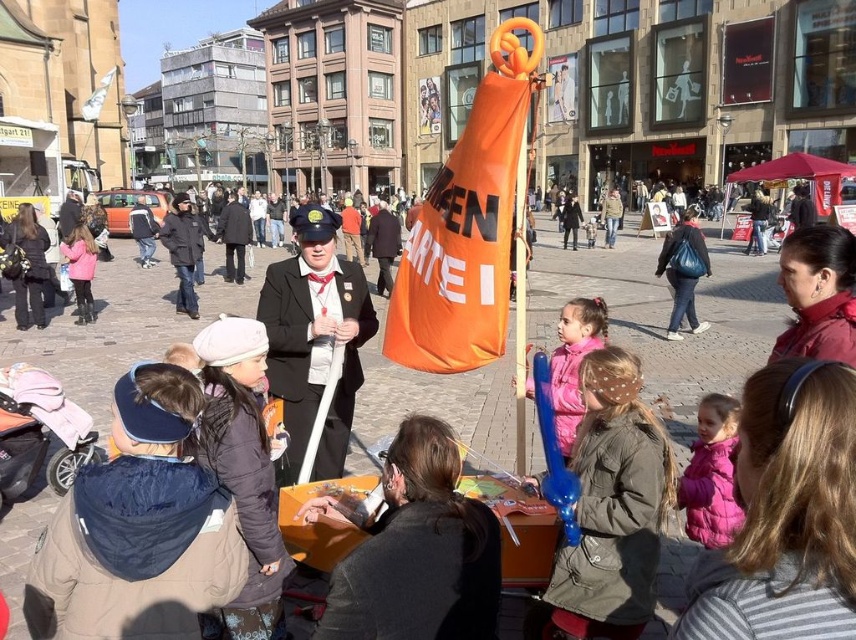
Is point (563, 557) less distant than point (235, 198)?

Yes.

Is point (553, 616) positioned behind point (224, 269)?

That is False.

I want to click on matte blue balloon at center, so click(611, 506).

Between point (322, 273) and point (226, 365), which one is positioned in front?

Point (226, 365) is in front.

Does matte black uniform at center have a greater height compared to dark gray puffer jacket at lower left?

Correct, matte black uniform at center is much taller as dark gray puffer jacket at lower left.

Between point (312, 204) and point (207, 632), which one is positioned behind?

Point (312, 204)

Locate an element on the screen. The image size is (856, 640). matte black uniform at center is located at coordinates (314, 339).

Is dark gray puffer jacket at lower left above black fabric coat at center?

No, dark gray puffer jacket at lower left is not above black fabric coat at center.

How far apart are dark gray puffer jacket at lower left and black fabric coat at center?

The distance of dark gray puffer jacket at lower left from black fabric coat at center is 86.48 feet.

Between point (230, 432) and point (232, 262), which one is positioned in front?

Positioned in front is point (230, 432).

Locate an element on the screen. This screenshot has width=856, height=640. dark gray puffer jacket at lower left is located at coordinates (242, 472).